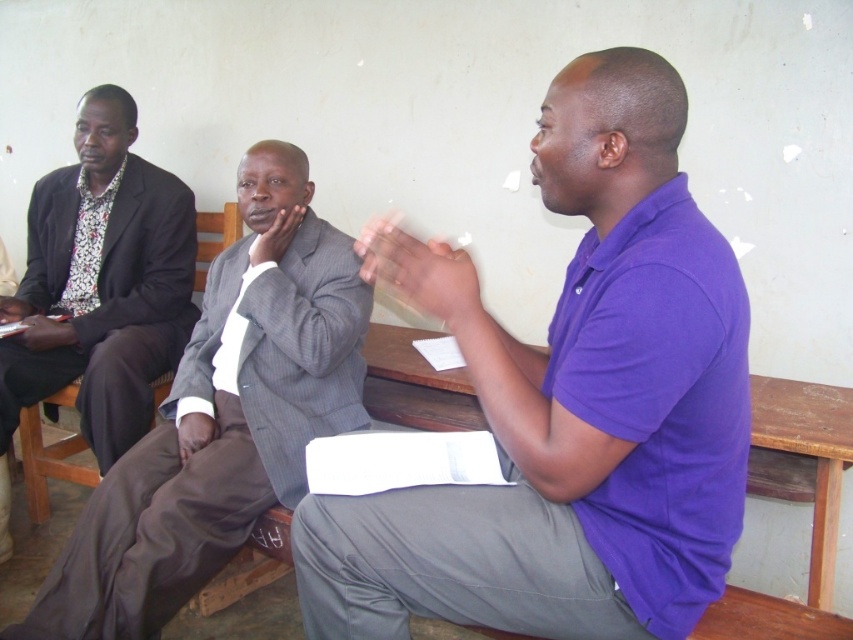
Based on the scene description, where is the gray pinstripe suit at center located in terms of its 2D coordinates?

The gray pinstripe suit at center is located at the 2D coordinates point (222, 417).

You are a photographer setting up for a group photo. You need to position the purple cotton shirt at center and the floral print shirt at left so that both are visible in the frame. Based on their current positions, which shirt should you adjust to ensure both are fully visible?

The purple cotton shirt at center is in front of the floral print shirt at left, so you should move the purple cotton shirt at center slightly backward to allow the floral print shirt at left to be fully visible.

You are organizing a photo shoot and need to arrange two men wearing the purple cotton shirt at center and the gray pinstripe suit at center side by side. Based on their clothing dimensions, which one should be placed on the left to ensure proper alignment?

The purple cotton shirt at center has a lesser width compared to the gray pinstripe suit at center, so placing the purple cotton shirt at center on the left would allow for proper alignment as it takes up less space.